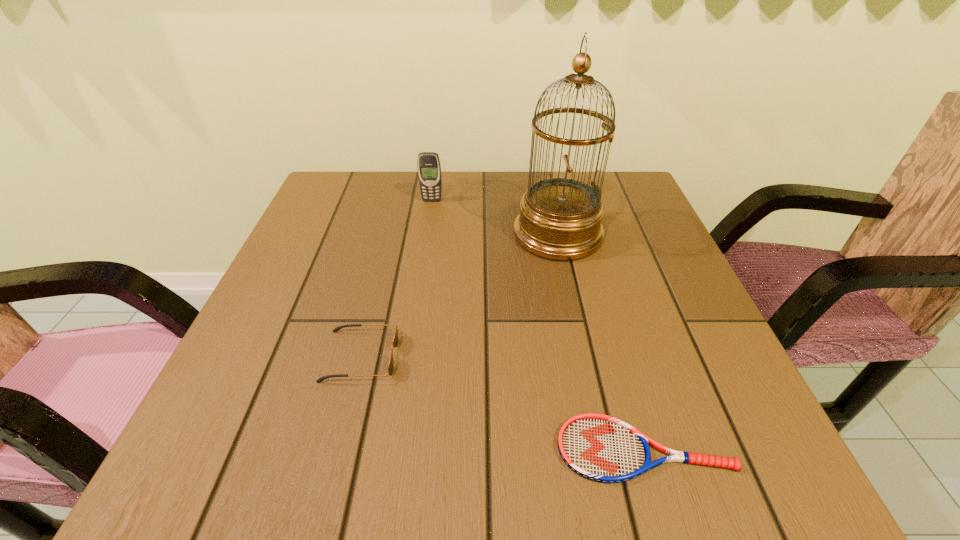
Where is `free space between the second nearest object and the tennis racket`? free space between the second nearest object and the tennis racket is located at coordinates tap(502, 403).

The height and width of the screenshot is (540, 960). In order to click on free spot between the tennis racket and the sunglasses in this screenshot , I will do `click(502, 403)`.

Identify the location of vacant region between the cellular telephone and the tennis racket. (538, 325).

Identify the location of free space between the second farthest object and the farthest object. This screenshot has width=960, height=540. coord(494,217).

Identify the location of free point between the tennis racket and the sunglasses. This screenshot has height=540, width=960. [502, 403].

Where is `free spot between the tennis racket and the second farthest object`? free spot between the tennis racket and the second farthest object is located at coordinates (601, 341).

Identify the location of free spot between the tallest object and the nearest object. (601, 341).

Locate an element on the screen. This screenshot has height=540, width=960. free area in between the third shortest object and the second nearest object is located at coordinates (396, 279).

You are a GUI agent. You are given a task and a screenshot of the screen. Output one action in this format:
    pyautogui.click(x=<x>, y=<y>)
    Task: Click on the vacant space that's between the tennis racket and the third tallest object
    The image size is (960, 540).
    Given the screenshot: What is the action you would take?
    pyautogui.click(x=502, y=403)

Where is `the closest object to the shortest object`? This screenshot has height=540, width=960. the closest object to the shortest object is located at coordinates (395, 342).